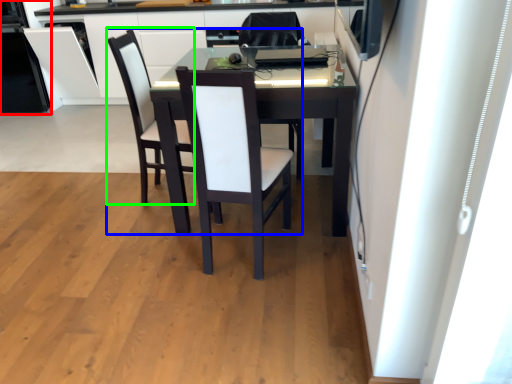
Question: Which object is positioned farthest from appliance (highlighted by a red box)? Select from chair (highlighted by a blue box) and armchair (highlighted by a green box).

Choices:
 (A) chair
 (B) armchair

Answer: (A)